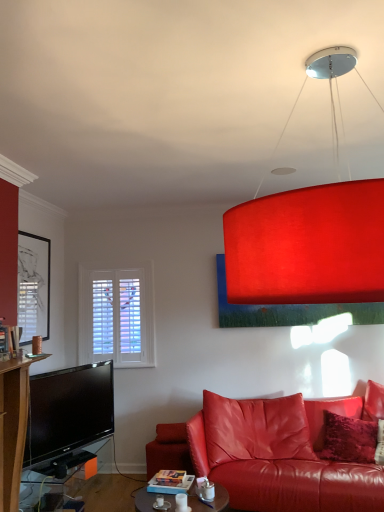
Question: From a real-world perspective, is velvet red pillow at lower right over matte black picture frame at left?

Choices:
 (A) no
 (B) yes

Answer: (A)

Question: Can you confirm if velvet red pillow at lower right is shorter than matte black picture frame at left?

Choices:
 (A) no
 (B) yes

Answer: (B)

Question: Considering the relative positions of velvet red pillow at lower right and matte black picture frame at left in the image provided, is velvet red pillow at lower right to the right of matte black picture frame at left from the viewer's perspective?

Choices:
 (A) yes
 (B) no

Answer: (A)

Question: From the image's perspective, is velvet red pillow at lower right above matte black picture frame at left?

Choices:
 (A) yes
 (B) no

Answer: (B)

Question: Can you confirm if velvet red pillow at lower right is wider than matte black picture frame at left?

Choices:
 (A) no
 (B) yes

Answer: (B)

Question: From a real-world perspective, is matte black tv stand at lower left, which appears as the first table when viewed from the left, above or below matte glass coffee table at center, marked as the 1th table in a right-to-left arrangement?

Choices:
 (A) above
 (B) below

Answer: (B)

Question: Is point (52, 480) positioned closer to the camera than point (221, 492)?

Choices:
 (A) closer
 (B) farther

Answer: (B)

Question: In terms of size, does matte black tv stand at lower left, which appears as the first table when viewed from the left, appear bigger or smaller than matte glass coffee table at center, the 2th table when ordered from left to right?

Choices:
 (A) small
 (B) big

Answer: (B)

Question: Is matte black tv stand at lower left, which appears as the first table when viewed from the left, in front of or behind matte glass coffee table at center, marked as the 1th table in a right-to-left arrangement, in the image?

Choices:
 (A) front
 (B) behind

Answer: (B)

Question: Is velvet red pillow at lower right in front of or behind matte glass coffee table at center, the 2th table when ordered from left to right, in the image?

Choices:
 (A) behind
 (B) front

Answer: (A)

Question: Is point (324, 434) closer or farther from the camera than point (221, 495)?

Choices:
 (A) farther
 (B) closer

Answer: (A)

Question: In terms of size, does velvet red pillow at lower right appear bigger or smaller than matte glass coffee table at center, the 2th table when ordered from left to right?

Choices:
 (A) big
 (B) small

Answer: (A)

Question: From a real-world perspective, relative to matte glass coffee table at center, the 2th table when ordered from left to right, is velvet red pillow at lower right vertically above or below?

Choices:
 (A) above
 (B) below

Answer: (A)

Question: Is velvet red pillow at lower right in front of or behind matte black picture frame at left in the image?

Choices:
 (A) behind
 (B) front

Answer: (B)

Question: Is velvet red pillow at lower right wider or thinner than matte black picture frame at left?

Choices:
 (A) wide
 (B) thin

Answer: (A)